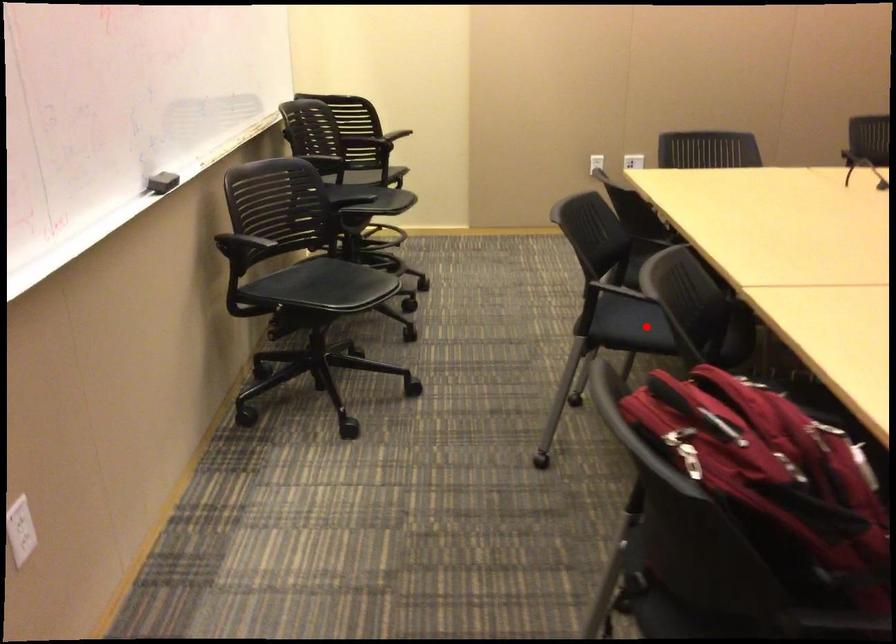
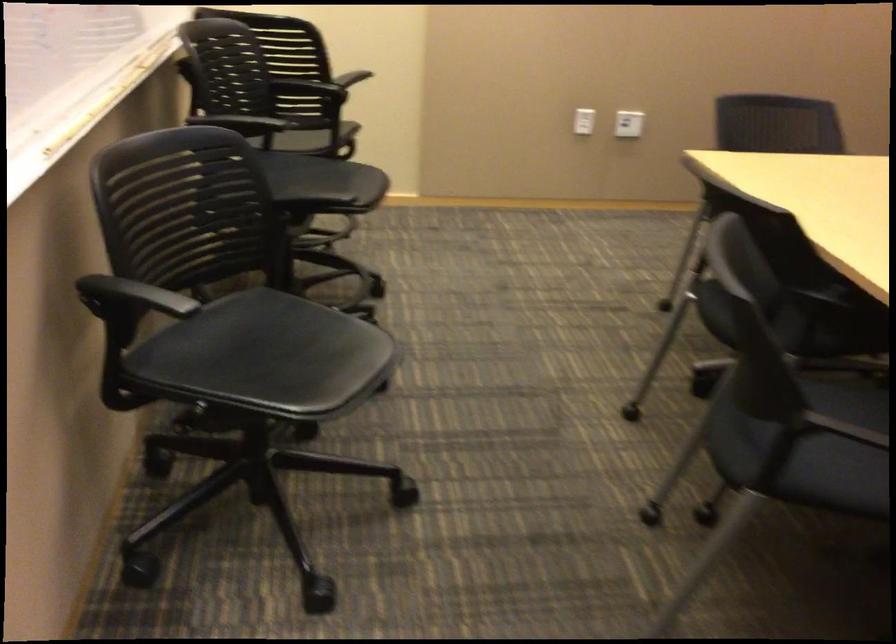
Question: I am providing you with two images of the same scene from different viewpoints. In image1, a red point is highlighted. Considering the same 3D point in image2, which of the following is correct?

Choices:
 (A) It is closer
 (B) It is farther

Answer: (A)